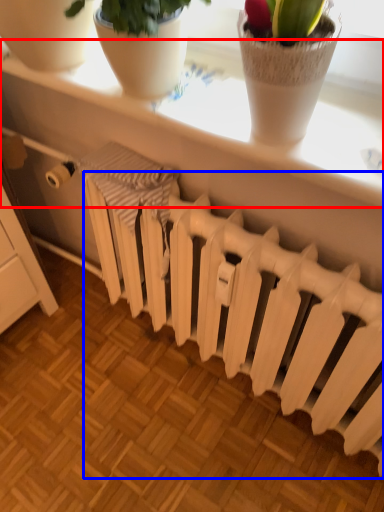
Question: Which object is closer to the camera taking this photo, window sill (highlighted by a red box) or radiator (highlighted by a blue box)?

Choices:
 (A) window sill
 (B) radiator

Answer: (A)